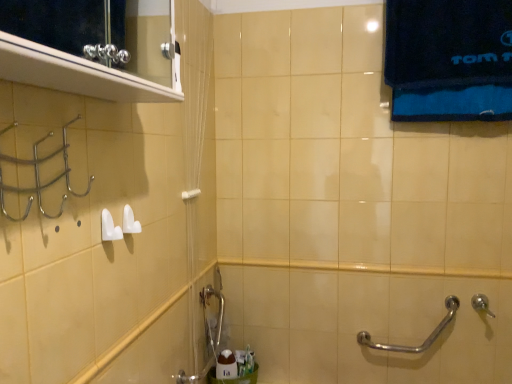
Question: Does point (450, 296) appear closer or farther from the camera than point (224, 375)?

Choices:
 (A) closer
 (B) farther

Answer: (A)

Question: From a real-world perspective, is silver metallic grab bar at lower right above or below white glossy soap at lower center?

Choices:
 (A) above
 (B) below

Answer: (A)

Question: Estimate the real-world distances between objects in this image. Which object is farther from the silver metallic shower at lower right?

Choices:
 (A) metallic silver medicine cabinet at upper left
 (B) silver metallic grab bar at lower right
 (C) brushed metal faucet at lower center
 (D) white glossy soap at lower center
 (E) white plastic towel bar at upper center

Answer: (A)

Question: Estimate the real-world distances between objects in this image. Which object is farther from the metallic silver medicine cabinet at upper left?

Choices:
 (A) silver metallic shower at lower right
 (B) white glossy soap at lower center
 (C) white plastic towel bar at upper center
 (D) silver metallic grab bar at lower right
 (E) brushed metal faucet at lower center

Answer: (A)